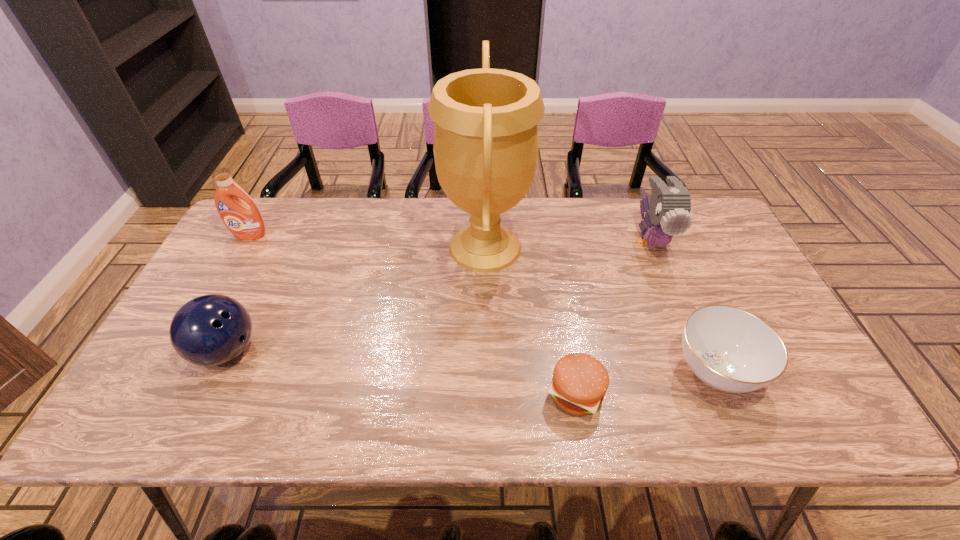
Where is `bowling ball that is at the left edge`? This screenshot has height=540, width=960. bowling ball that is at the left edge is located at coordinates (209, 330).

Locate an element on the screen. object positioned at the right edge is located at coordinates (729, 349).

The height and width of the screenshot is (540, 960). I want to click on object located at the far left corner, so click(243, 219).

The width and height of the screenshot is (960, 540). Identify the location of object that is positioned at the near right corner. 729,349.

The height and width of the screenshot is (540, 960). In the image, there is a desktop. Identify the location of vacant space at the far edge. (615, 212).

I want to click on free region at the near edge of the desktop, so click(738, 404).

Locate an element on the screen. This screenshot has height=540, width=960. vacant space at the left edge is located at coordinates (247, 266).

Locate an element on the screen. The image size is (960, 540). free space at the right edge is located at coordinates (784, 382).

At what (x,y) coordinates should I click in order to perform the action: click on vacant space at the far left corner of the desktop. Please return your answer as a coordinate pair (x, y). This screenshot has width=960, height=540. Looking at the image, I should click on (284, 198).

This screenshot has width=960, height=540. In the image, there is a desktop. In order to click on free space at the far right corner in this screenshot , I will do `click(695, 241)`.